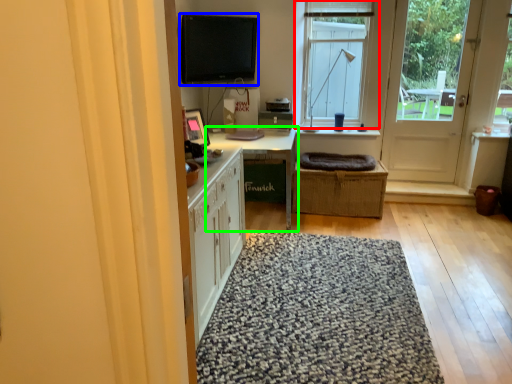
Question: Considering the real-world distances, which object is farthest from window (highlighted by a red box)? computer monitor (highlighted by a blue box) or table (highlighted by a green box)?

Choices:
 (A) computer monitor
 (B) table

Answer: (B)